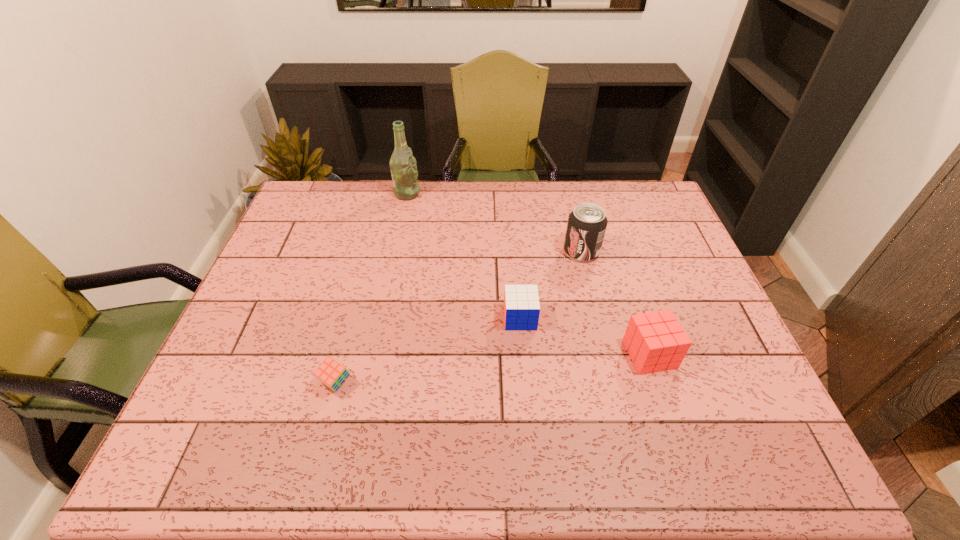
Find the location of `free region located 0.290m on the surface of the beer bottle`. free region located 0.290m on the surface of the beer bottle is located at coordinates (502, 193).

Locate an element on the screen. The height and width of the screenshot is (540, 960). vacant space situated on the right of the soda can is located at coordinates coord(648,252).

I want to click on vacant space located on the back of the rightmost cube, so click(616, 254).

Where is `free space located on the left of the third object from left to right`? The width and height of the screenshot is (960, 540). free space located on the left of the third object from left to right is located at coordinates (375, 318).

Find the location of a particular element. free location located 0.160m on the right of the leftmost cube is located at coordinates (420, 382).

Find the location of a particular element. object at the far edge is located at coordinates (404, 173).

This screenshot has width=960, height=540. What are the coordinates of `object at the right edge` in the screenshot? It's located at pos(655,341).

Locate an element on the screen. This screenshot has width=960, height=540. vacant space at the far edge is located at coordinates (422, 212).

At what (x,y) coordinates should I click in order to perform the action: click on free space at the near edge of the desktop. Please return your answer as a coordinate pair (x, y). Image resolution: width=960 pixels, height=540 pixels. Looking at the image, I should click on (563, 443).

In the image, there is a desktop. Where is `vacant region at the left edge`? The height and width of the screenshot is (540, 960). vacant region at the left edge is located at coordinates (285, 298).